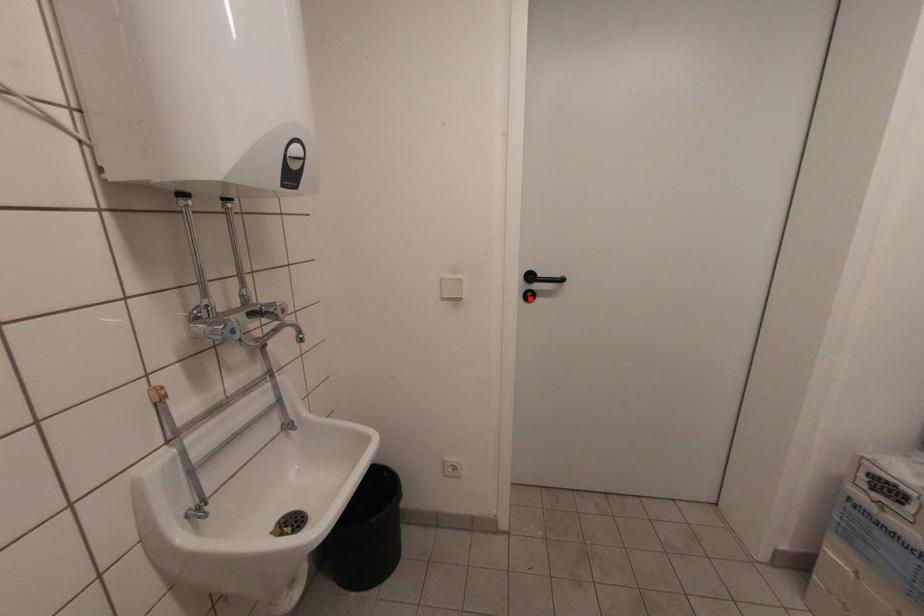
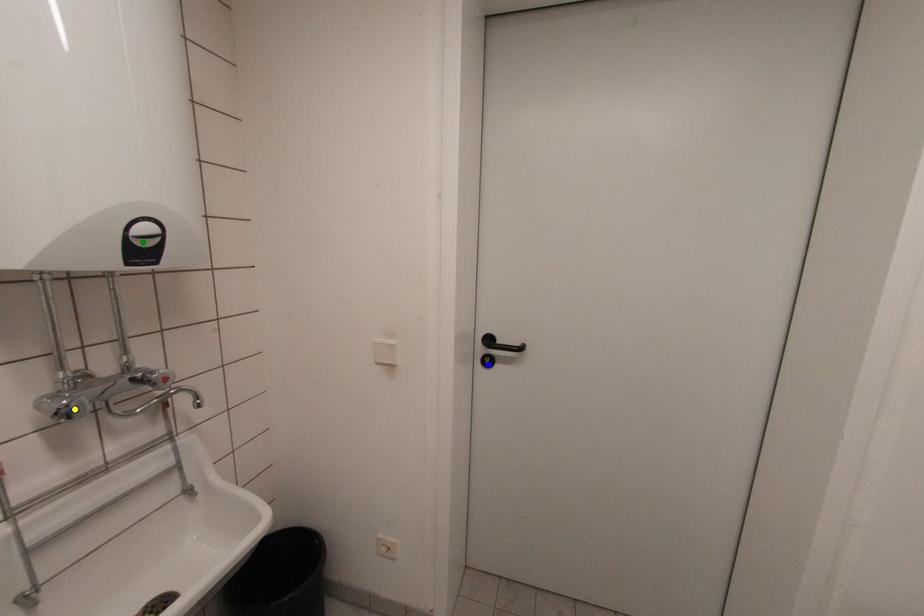
Question: I am providing you with two images of the same scene from different viewpoints. A red point is marked on the first image. You are given multiple points on the second image. Which point in image 2 represents the same 3d spot as the red point in image 1?

Choices:
 (A) yellow point
 (B) green point
 (C) blue point

Answer: (C)